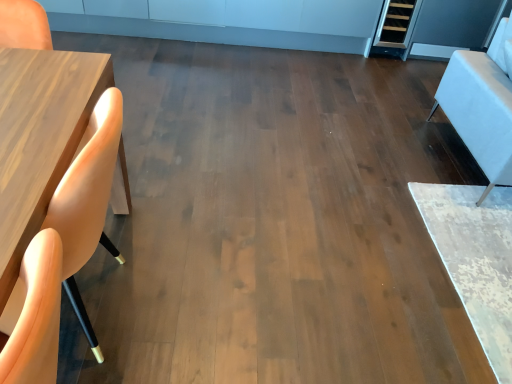
At what (x,y) coordinates should I click in order to perform the action: click on vacant space that is in between matte wood chair at left and white leather armchair at right. Please return your answer as a coordinate pair (x, y). This screenshot has height=384, width=512. Looking at the image, I should click on coord(294,215).